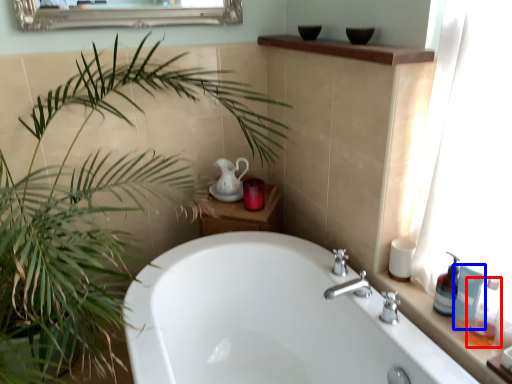
Question: Which object is further to the camera taking this photo, soap dispenser (highlighted by a red box) or toiletry (highlighted by a blue box)?

Choices:
 (A) soap dispenser
 (B) toiletry

Answer: (B)